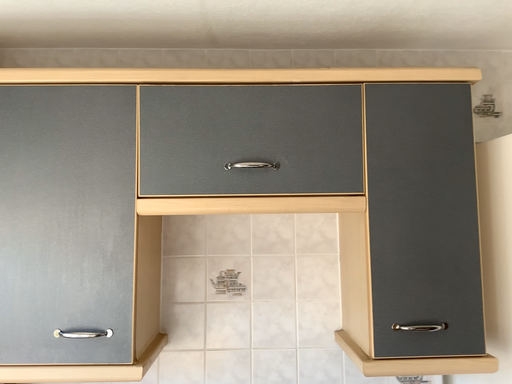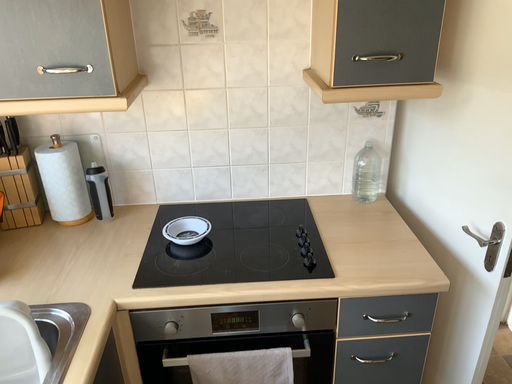
Question: Which way did the camera rotate in the video?

Choices:
 (A) rotated downward
 (B) rotated upward

Answer: (A)